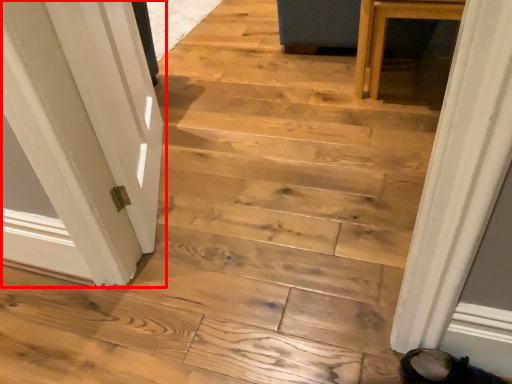
Question: In this image, where is door (annotated by the red box) located relative to footwear?

Choices:
 (A) right
 (B) left

Answer: (B)